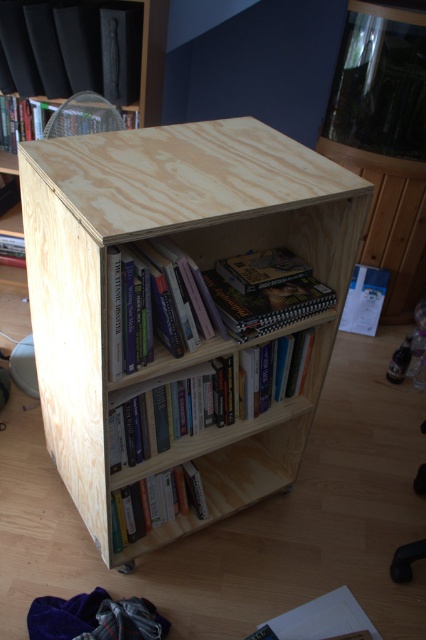
Question: Is hardcover books at center to the left of hardcover book at lower center from the viewer's perspective?

Choices:
 (A) yes
 (B) no

Answer: (B)

Question: Considering the real-world distances, which object is closest to the plywood bookshelf at center?

Choices:
 (A) hardcover book at lower center
 (B) plywood bookcase at center
 (C) black matte book at upper left
 (D) hardcover book at upper left

Answer: (A)

Question: Can you confirm if black matte book at upper left is positioned above matte wood book at center?

Choices:
 (A) no
 (B) yes

Answer: (B)

Question: Which of the following is the farthest from the observer?

Choices:
 (A) hardcover book at upper left
 (B) plywood bookshelf at center

Answer: (A)

Question: Is plywood bookshelf at center below matte wood book at center?

Choices:
 (A) yes
 (B) no

Answer: (A)

Question: Which object is closer to the camera taking this photo?

Choices:
 (A) plywood bookshelf at center
 (B) hardcover book at lower center
 (C) hardcover book at upper left
 (D) wooden bookshelf at center

Answer: (A)